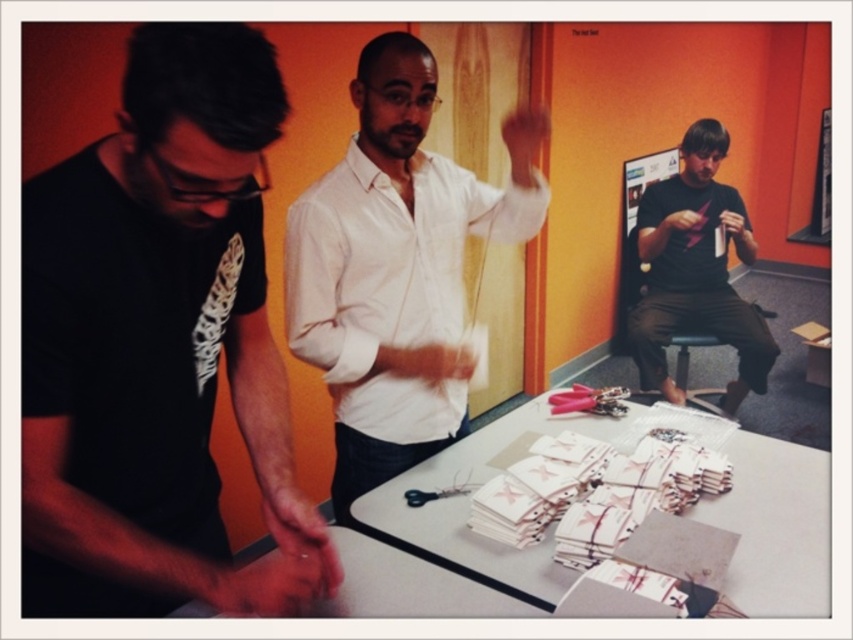
Is black matte t-shirt at left to the left of matte black shirt at right from the viewer's perspective?

Yes, black matte t-shirt at left is to the left of matte black shirt at right.

Does point (55, 472) come behind point (723, 323)?

No, it is not.

The height and width of the screenshot is (640, 853). What are the coordinates of `black matte t-shirt at left` in the screenshot? It's located at (158, 344).

Is black matte t-shirt at left shorter than white paper at center?

No.

Does black matte t-shirt at left have a greater width compared to white paper at center?

In fact, black matte t-shirt at left might be narrower than white paper at center.

Identify the location of black matte t-shirt at left. (158, 344).

Is white cotton shirt at center below matte black shirt at right?

Indeed, white cotton shirt at center is positioned under matte black shirt at right.

This screenshot has height=640, width=853. I want to click on white cotton shirt at center, so click(392, 282).